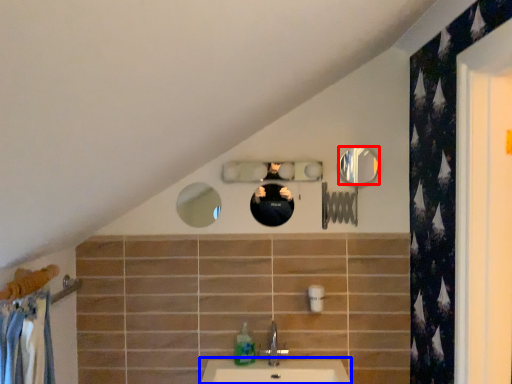
Question: Which point is closer to the camera, mirror (highlighted by a red box) or counter top (highlighted by a blue box)?

Choices:
 (A) mirror
 (B) counter top

Answer: (B)